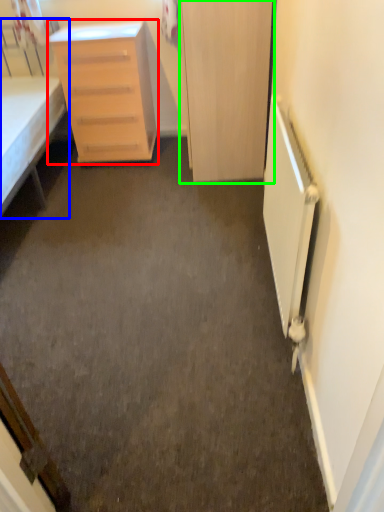
Question: Considering the real-world distances, which object is closest to chest of drawers (highlighted by a red box)? bed (highlighted by a blue box) or door (highlighted by a green box).

Choices:
 (A) bed
 (B) door

Answer: (A)